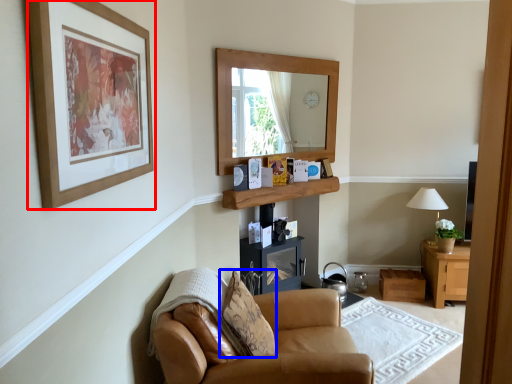
Question: Among these objects, which one is nearest to the camera, picture frame (highlighted by a red box) or pillow (highlighted by a blue box)?

Choices:
 (A) picture frame
 (B) pillow

Answer: (A)